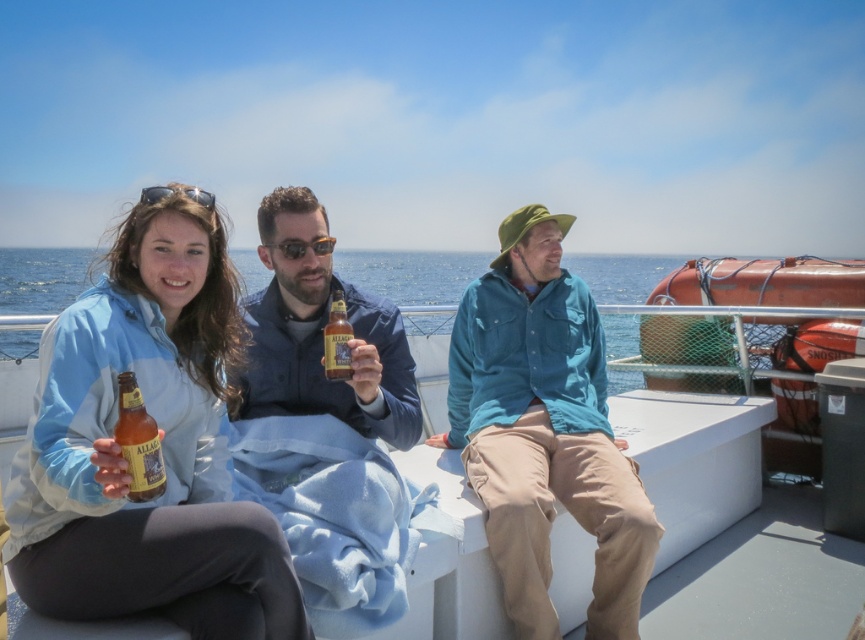
Question: Does white plastic boat at center appear on the right side of amber glass bottle at center?

Choices:
 (A) no
 (B) yes

Answer: (A)

Question: Which of the following is the farthest from the observer?

Choices:
 (A) amber glass bottle at center
 (B) amber glass bottle at lower left
 (C) white plastic boat at center

Answer: (C)

Question: Estimate the real-world distances between objects in this image. Which object is farther from the amber glass bottle at center?

Choices:
 (A) white plastic boat at center
 (B) matte blue jacket at center
 (C) teal cotton shirt at center
 (D) amber glass bottle at lower left

Answer: (A)

Question: Does matte glass bottle at center have a greater width compared to amber glass bottle at center?

Choices:
 (A) yes
 (B) no

Answer: (A)

Question: Does matte blue jacket at center have a smaller size compared to amber glass bottle at center?

Choices:
 (A) no
 (B) yes

Answer: (A)

Question: Which object appears closest to the camera in this image?

Choices:
 (A) amber glass bottle at lower left
 (B) matte blue jacket at center
 (C) matte glass bottle at center

Answer: (A)